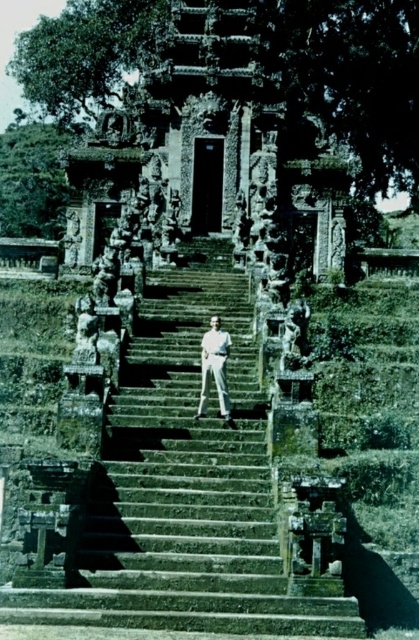
Question: Is green stone stairs at center closer to camera compared to white cotton pants at center?

Choices:
 (A) no
 (B) yes

Answer: (B)

Question: Is green stone stairs at center wider than white cotton pants at center?

Choices:
 (A) no
 (B) yes

Answer: (B)

Question: Does green stone stairs at center appear on the left side of white cotton pants at center?

Choices:
 (A) no
 (B) yes

Answer: (B)